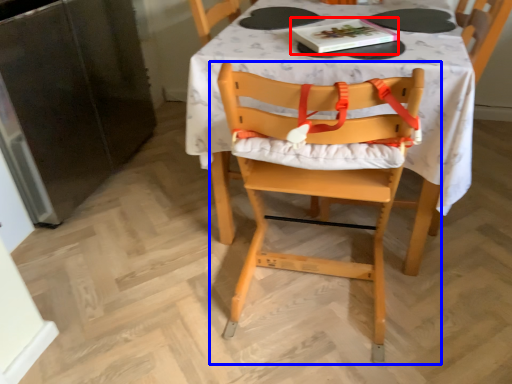
Question: Which object appears farthest to the camera in this image, book (highlighted by a red box) or chair (highlighted by a blue box)?

Choices:
 (A) book
 (B) chair

Answer: (A)